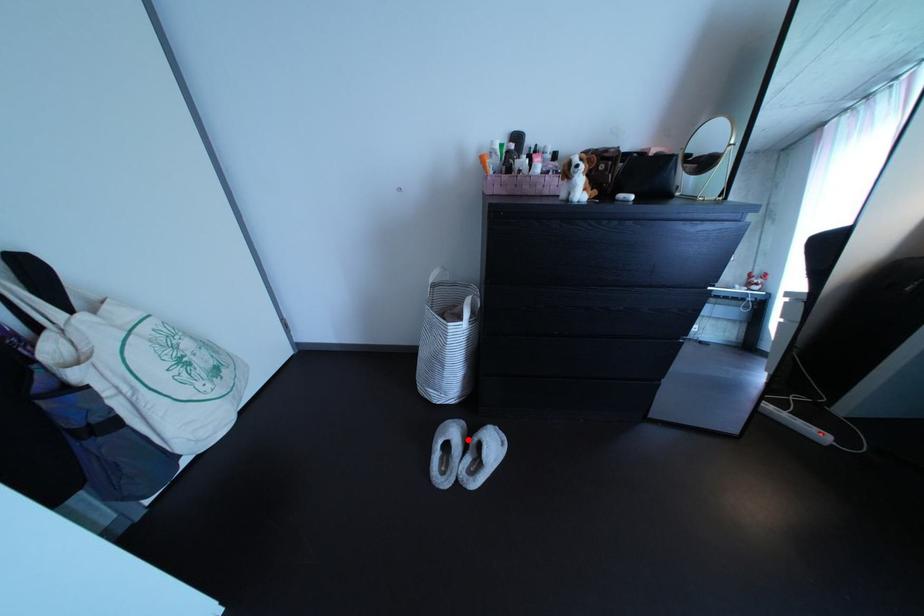
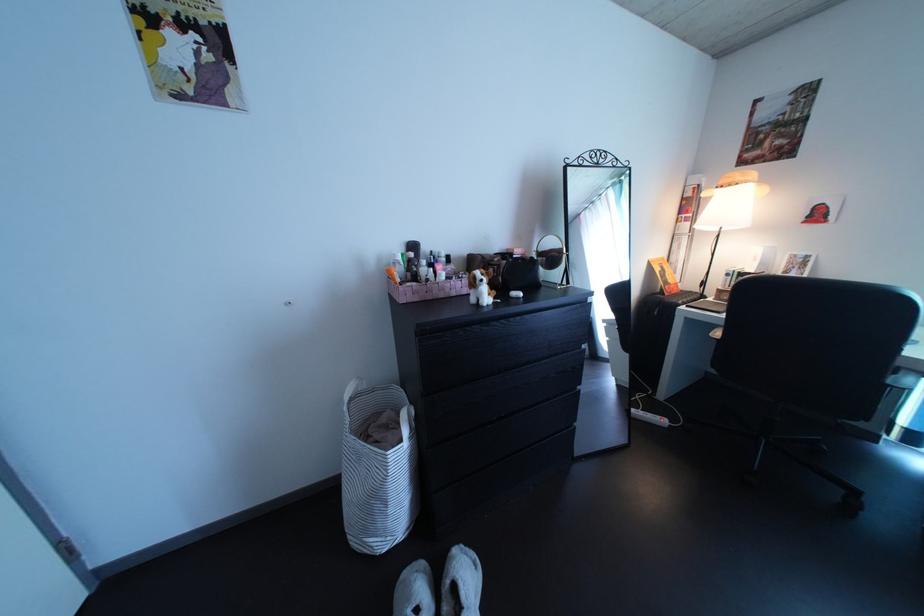
In the second image, find the point that corresponds to the highlighted location in the first image.

(432, 596)